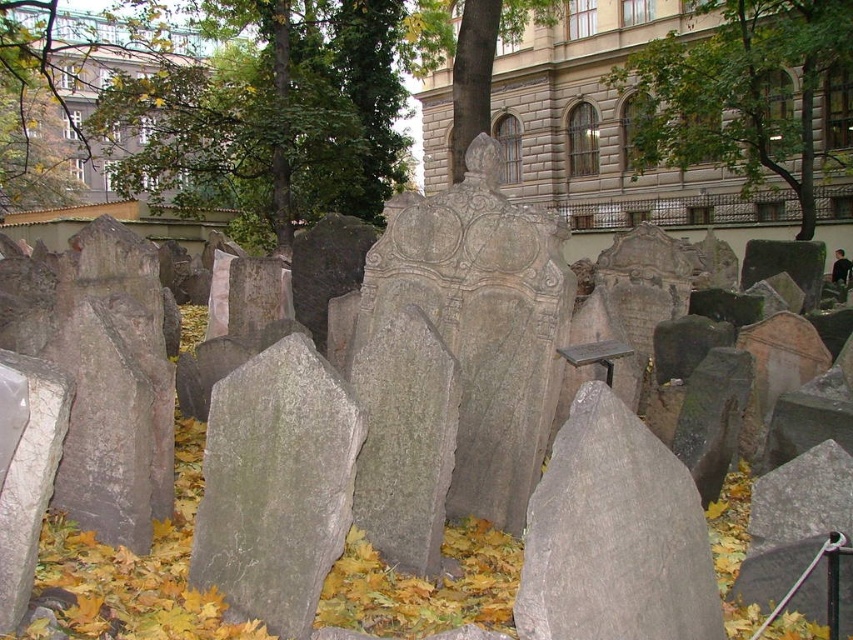
Which is more to the left, green leafy tree at upper center or green leafy tree at center?

green leafy tree at center

This screenshot has width=853, height=640. Describe the element at coordinates (740, 92) in the screenshot. I see `green leafy tree at upper center` at that location.

The image size is (853, 640). What are the coordinates of `green leafy tree at upper center` in the screenshot? It's located at (740, 92).

Measure the distance from gray rough stone at center to green leafy tree at upper center.

They are 26.96 meters apart.

Between gray rough stone at center and green leafy tree at upper center, which one appears on the left side from the viewer's perspective?

From the viewer's perspective, gray rough stone at center appears more on the left side.

Where is `gray rough stone at center`? gray rough stone at center is located at coordinates (614, 536).

Is gray rough stone at center shorter than green leafy tree at center?

Indeed, gray rough stone at center has a lesser height compared to green leafy tree at center.

Between gray rough stone at center and green leafy tree at center, which one has less height?

Standing shorter between the two is gray rough stone at center.

Is point (601, 483) positioned before point (450, 140)?

Yes.

The width and height of the screenshot is (853, 640). Find the location of `gray rough stone at center`. gray rough stone at center is located at coordinates (614, 536).